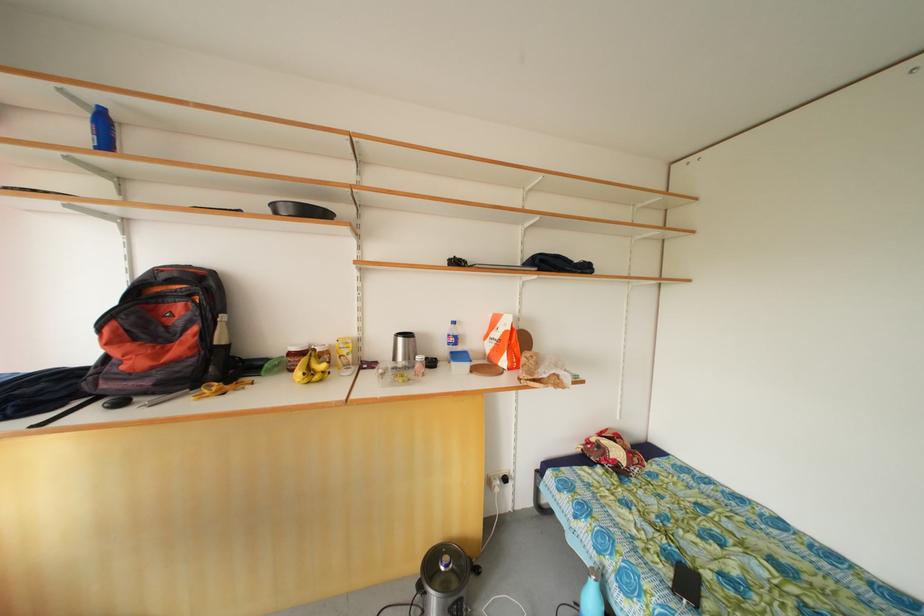
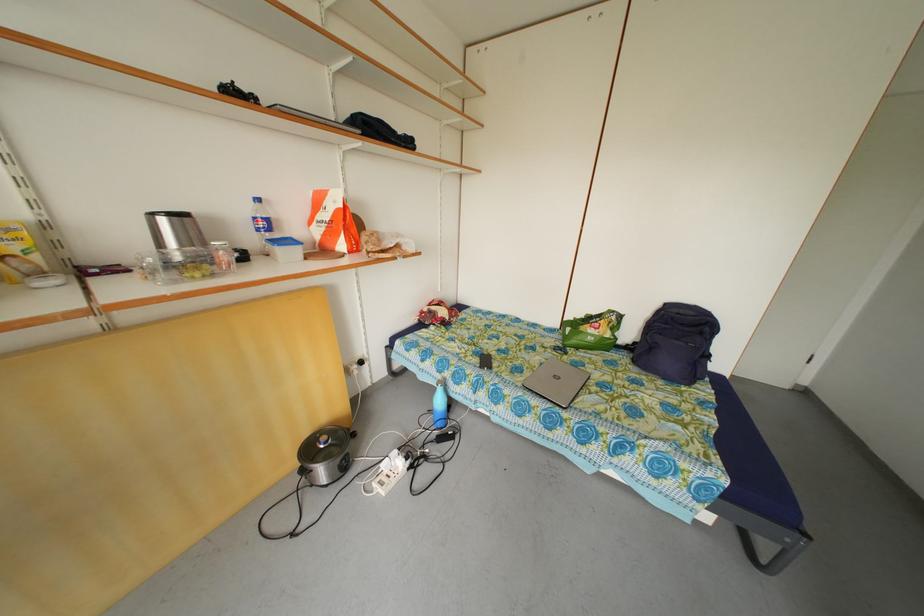
Locate, in the second image, the point that corresponds to point 444,545 in the first image.

(313, 440)